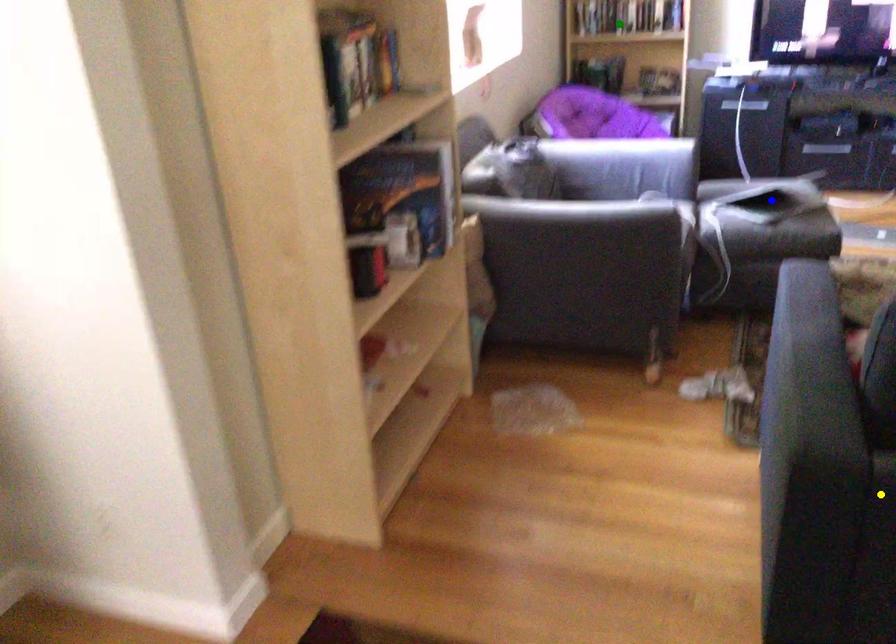
Order these from nearest to farthest:
blue point
green point
yellow point

yellow point
blue point
green point